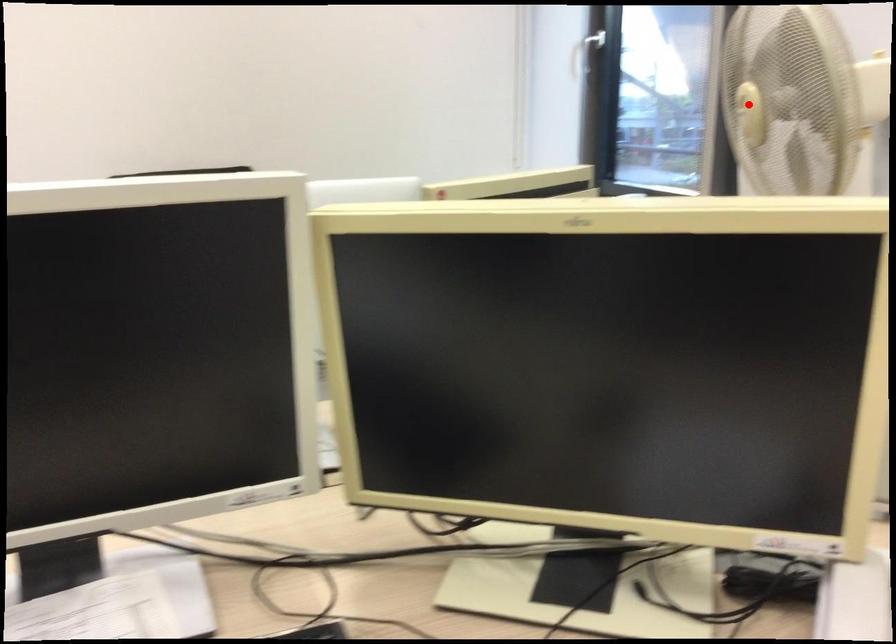
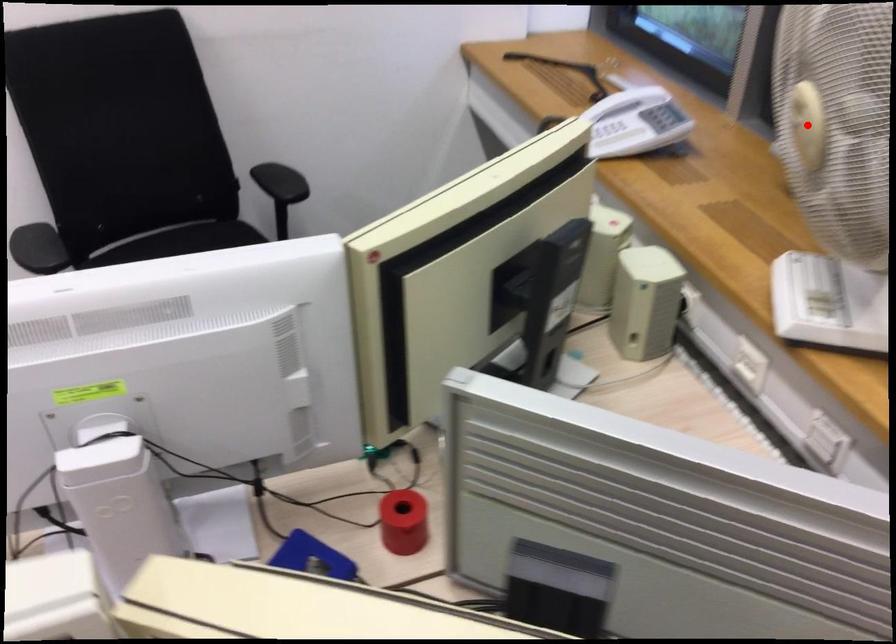
I am providing you with two images of the same scene from different viewpoints. A red point is marked on the first image and another point is marked on the second image. Is the red point in image1 aligned with the point shown in image2?

Yes